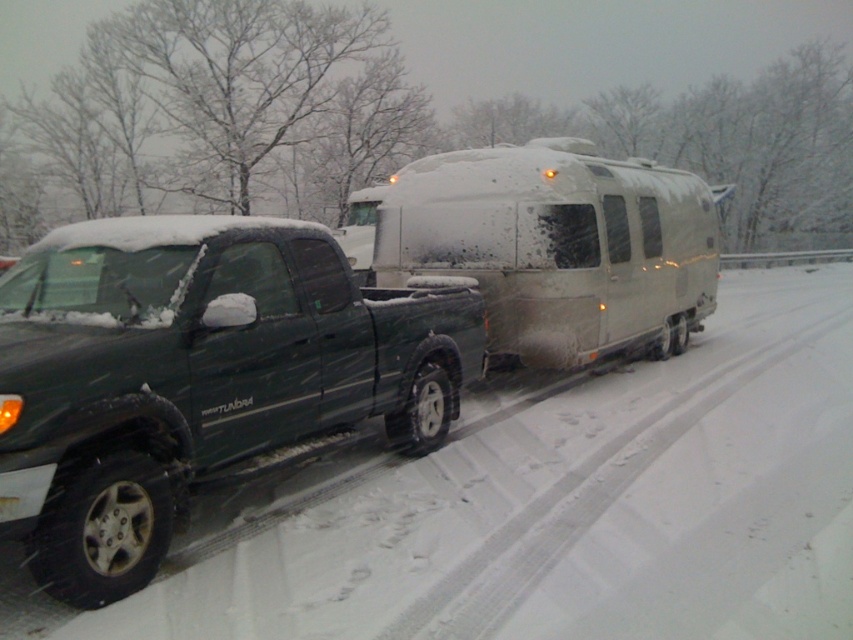
Question: Which object appears closest to the camera in this image?

Choices:
 (A) matte black truck at left
 (B) white matte trailer at center

Answer: (A)

Question: Does matte black truck at left appear on the left side of white matte trailer at center?

Choices:
 (A) no
 (B) yes

Answer: (B)

Question: Observing the image, what is the correct spatial positioning of matte black truck at left in reference to white matte trailer at center?

Choices:
 (A) above
 (B) below

Answer: (B)

Question: In this image, where is matte black truck at left located relative to white matte trailer at center?

Choices:
 (A) above
 (B) below

Answer: (B)